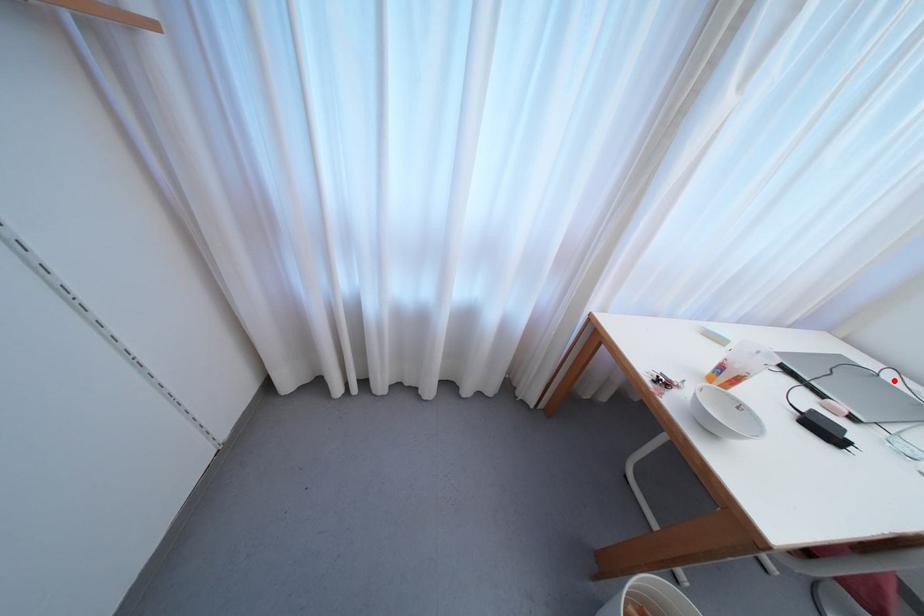
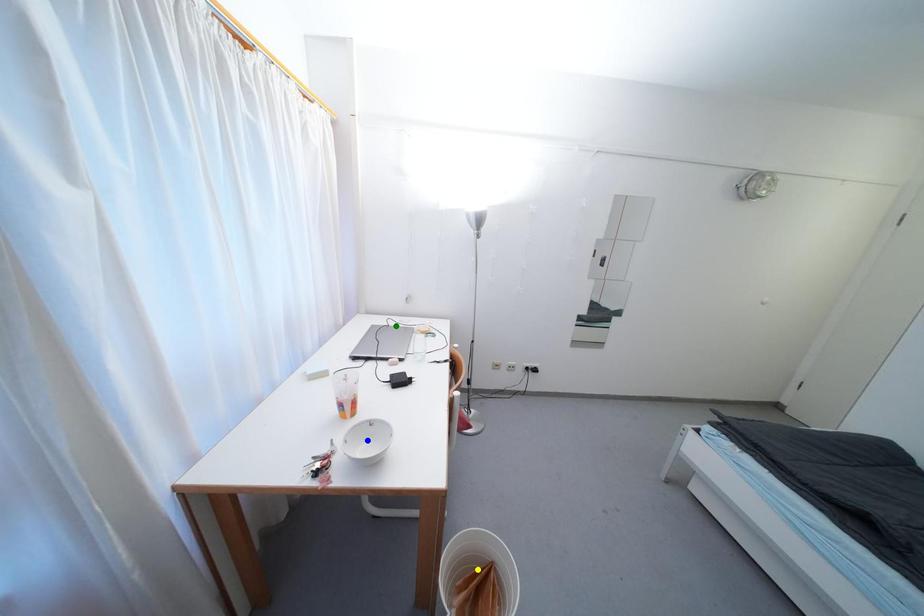
Question: I am providing you with two images of the same scene from different viewpoints. A red point is marked on the first image. You are given multiple points on the second image. In image 2, which mark is for the same physical point as the one in image 1?

Choices:
 (A) blue point
 (B) green point
 (C) yellow point

Answer: (B)